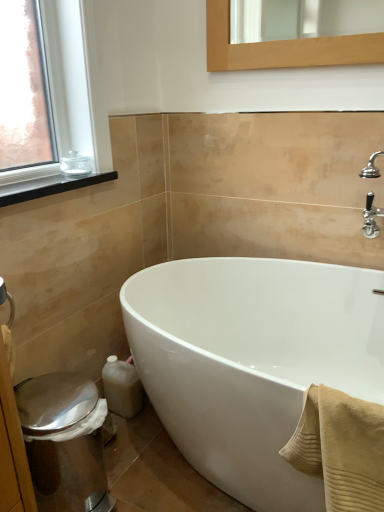
Question: Can you confirm if clear glass jar at upper left is bigger than shiny metallic bidet at lower left?

Choices:
 (A) no
 (B) yes

Answer: (A)

Question: Can you confirm if clear glass jar at upper left is positioned to the left of shiny metallic bidet at lower left?

Choices:
 (A) no
 (B) yes

Answer: (B)

Question: From the image's perspective, is clear glass jar at upper left under shiny metallic bidet at lower left?

Choices:
 (A) no
 (B) yes

Answer: (A)

Question: Is clear glass jar at upper left closer to camera compared to shiny metallic bidet at lower left?

Choices:
 (A) yes
 (B) no

Answer: (B)

Question: From a real-world perspective, is clear glass jar at upper left physically above shiny metallic bidet at lower left?

Choices:
 (A) yes
 (B) no

Answer: (A)

Question: Considering the relative sizes of clear glass jar at upper left and shiny metallic bidet at lower left in the image provided, is clear glass jar at upper left thinner than shiny metallic bidet at lower left?

Choices:
 (A) yes
 (B) no

Answer: (A)

Question: Is there a large distance between black matte window sill at upper left and white glossy bathtub at center?

Choices:
 (A) yes
 (B) no

Answer: (B)

Question: Can you confirm if black matte window sill at upper left is positioned to the left of white glossy bathtub at center?

Choices:
 (A) no
 (B) yes

Answer: (B)

Question: Is black matte window sill at upper left in contact with white glossy bathtub at center?

Choices:
 (A) no
 (B) yes

Answer: (A)

Question: From a real-world perspective, is black matte window sill at upper left beneath white glossy bathtub at center?

Choices:
 (A) yes
 (B) no

Answer: (B)

Question: Can we say black matte window sill at upper left lies outside white glossy bathtub at center?

Choices:
 (A) no
 (B) yes

Answer: (B)

Question: Does black matte window sill at upper left have a lesser height compared to white glossy bathtub at center?

Choices:
 (A) yes
 (B) no

Answer: (A)

Question: Does shiny metallic bidet at lower left have a lesser height compared to beige ribbed towel at lower right?

Choices:
 (A) no
 (B) yes

Answer: (A)